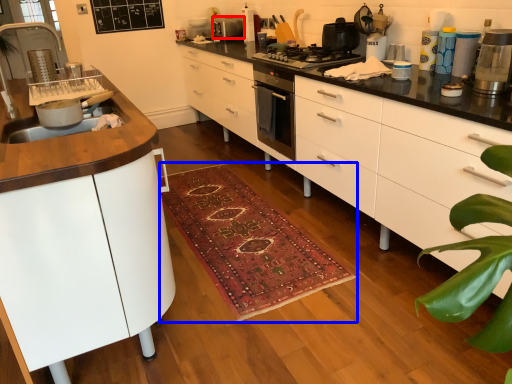
Question: Which point is further to the camera, kitchen appliance (highlighted by a red box) or doormat (highlighted by a blue box)?

Choices:
 (A) kitchen appliance
 (B) doormat

Answer: (A)